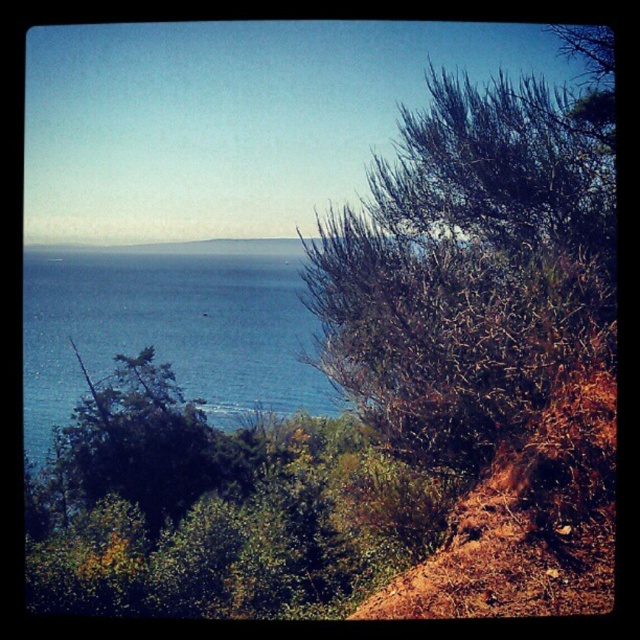
You are standing at the top of a cliff overlooking the coastal landscape. You see the blue water at left and the green leafy tree at left. Which one appears taller from your vantage point?

The blue water at left appears much taller than the green leafy tree at left from your vantage point.

Looking at this image, you are standing at the point with coordinates point(576, 202) and want to walk towards the point with coordinates point(148, 364). Given the terrain described in the scene, will you have an unobstructed path? Explain your reasoning based on the scene details.

The path between point(576, 202) and point(148, 364) is obstructed by the dense vegetation and shrubs in the foreground, making the path not unobstructed.